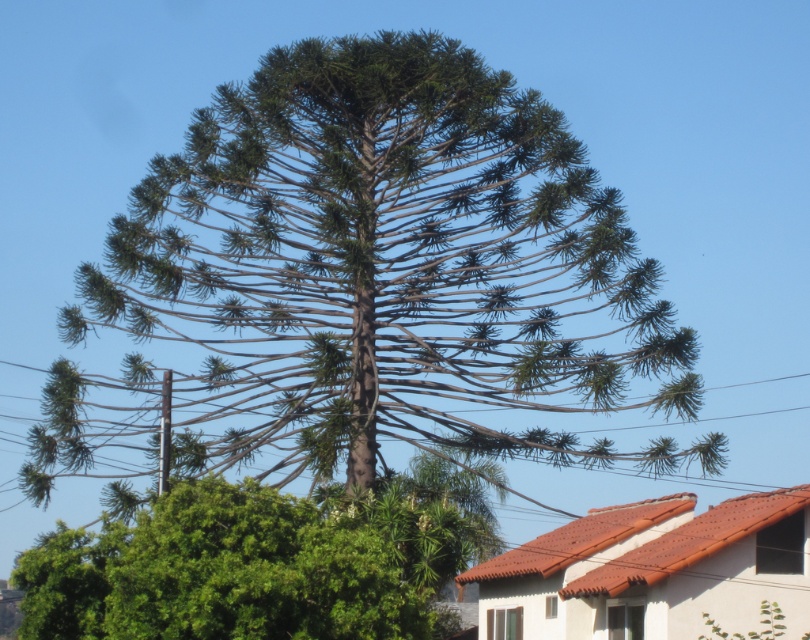
You are a bird looking for a place to land. You see the metallic wire at center and the green leafy tree at lower left. Which one is wider for you to perch on?

The metallic wire at center might be wider than green leafy tree at lower left, so the metallic wire at center is likely a better option for perching.

You are standing in a park and see the tall, unique tree with a distinctive tiered structure at the center. There is a point marked at coordinates (x=371, y=280). What object does this point correspond to?

The point corresponds to the green textured tree at center.

You are a landscape architect designing a garden. You need to place a new statue between the green textured tree at center and the green leafy tree at lower left. Considering their widths, which tree should the statue be closer to to ensure it doesn

The green textured tree at center is wider than the green leafy tree at lower left. To ensure the statue is placed appropriately between them, it should be closer to the green leafy tree at lower left since the wider tree occupies more space.